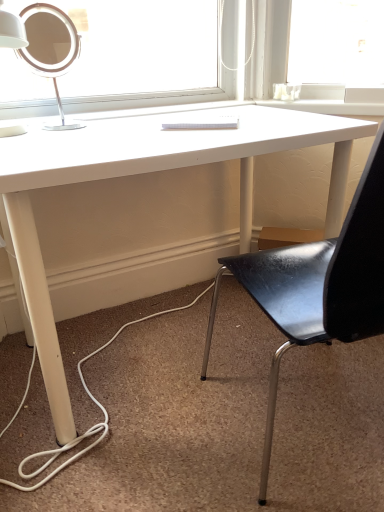
Identify the location of free spot below black leather chair at center (from a real-world perspective). (294, 429).